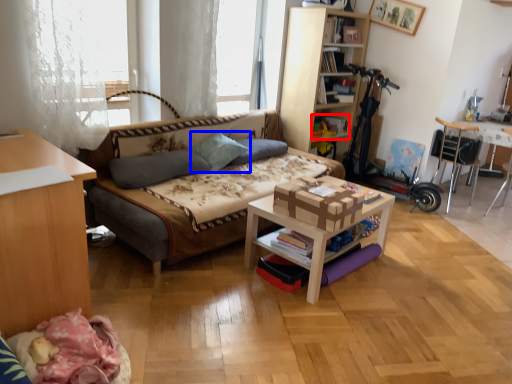
Question: Which of the following is the farthest to the observer, book (highlighted by a red box) or pillow (highlighted by a blue box)?

Choices:
 (A) book
 (B) pillow

Answer: (A)